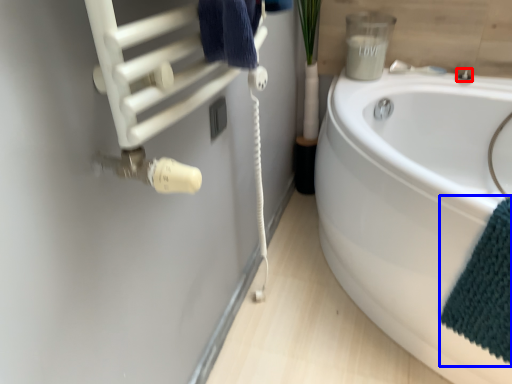
Question: Among these objects, which one is nearest to the camera, faucet (highlighted by a red box) or bath towel (highlighted by a blue box)?

Choices:
 (A) faucet
 (B) bath towel

Answer: (B)